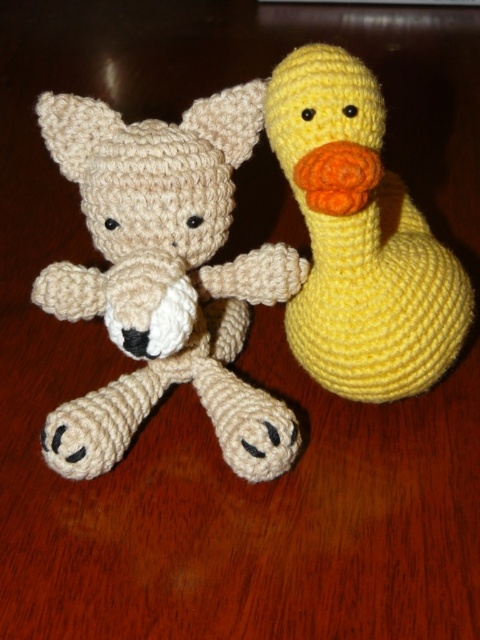
Question: Can you confirm if beige yarn stuffed animal at left is wider than yellow yarn duck at right?

Choices:
 (A) yes
 (B) no

Answer: (A)

Question: Is beige yarn stuffed animal at left positioned behind yellow yarn duck at right?

Choices:
 (A) no
 (B) yes

Answer: (B)

Question: Can you confirm if beige yarn stuffed animal at left is smaller than yellow yarn duck at right?

Choices:
 (A) yes
 (B) no

Answer: (B)

Question: Which of the following is the farthest from the observer?

Choices:
 (A) beige yarn stuffed animal at left
 (B) yellow yarn duck at right

Answer: (A)

Question: Which of the following is the closest to the observer?

Choices:
 (A) (48, 120)
 (B) (452, 291)

Answer: (A)